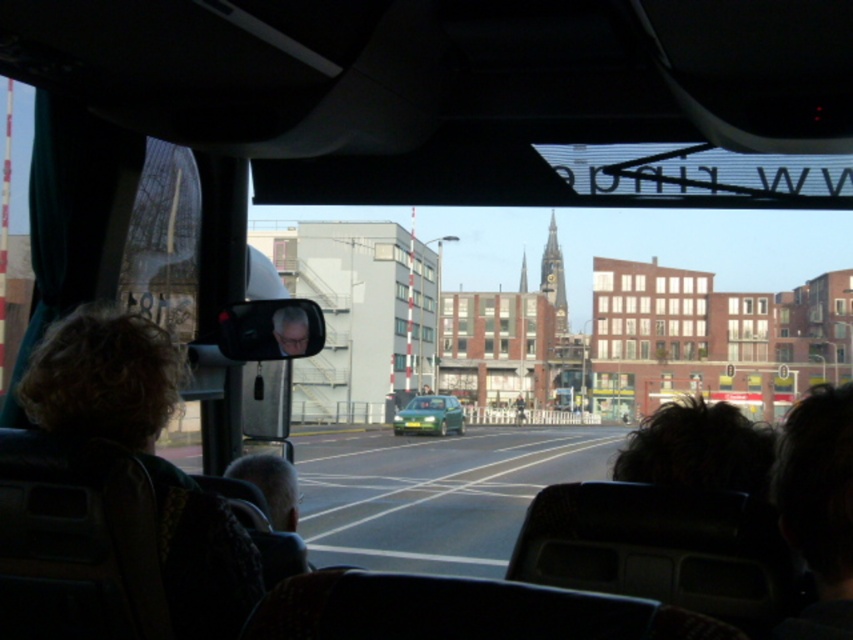
You are a passenger sitting in the bus and looking out the front windshield. You see two points marked on the window. The first point is at coordinate point (827, 394) and the second is at point (288, 332). Which of these two points is closer to the road ahead?

Point (827, 394) is in front of point (288, 332), so the point at (827, 394) is closer to the road ahead.

You are a passenger sitting in the front seat of the bus. You notice two features in the center of your view through the windshield. One is gray hair at center and the other is matte plastic face at center. Which one is wider?

The gray hair at center is wider than the matte plastic face at center according to the description.

You are a passenger on the bus and you see a gray hair at center located at point (270,484). Is the gray hair at center in front of or behind the bus?

The gray hair at center is located at point (270,484), which is part of the exterior scene visible through the windshield, so it is in front of the bus.